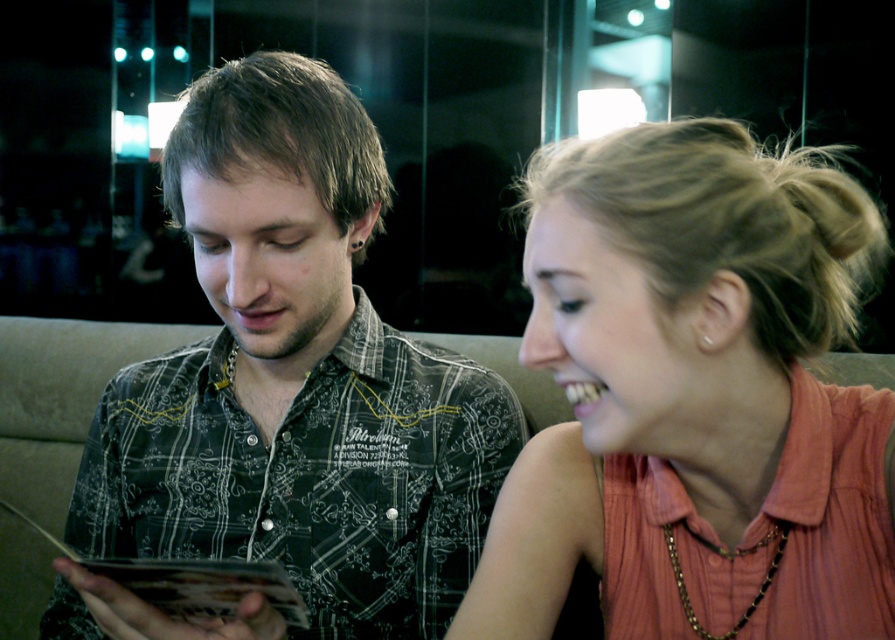
Looking at this image, which is above, matte coral blouse at center or black printed shirt at center?

matte coral blouse at center is above.

Does point (702, 282) lie in front of point (226, 200)?

Yes, it is in front of point (226, 200).

At what (x,y) coordinates should I click in order to perform the action: click on matte coral blouse at center. Please return your answer as a coordinate pair (x, y). This screenshot has width=895, height=640. Looking at the image, I should click on (695, 397).